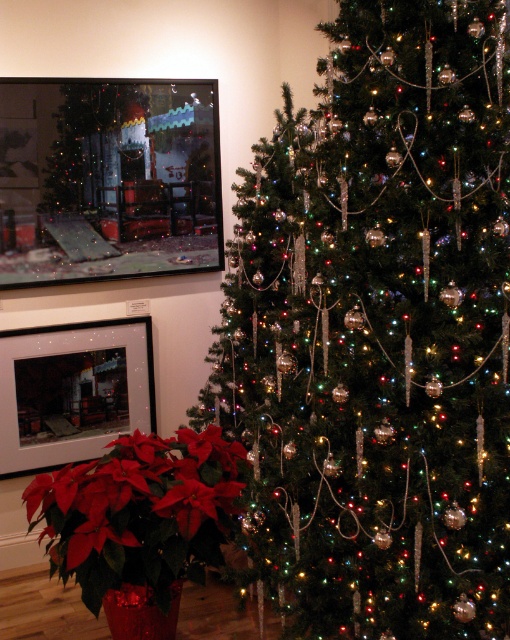
The height and width of the screenshot is (640, 510). Describe the element at coordinates (377, 332) in the screenshot. I see `shiny metallic tree at center` at that location.

Does shiny metallic tree at center have a greater width compared to red matte poinsettia at lower left?

Yes.

The image size is (510, 640). In order to click on shiny metallic tree at center in this screenshot , I will do `click(377, 332)`.